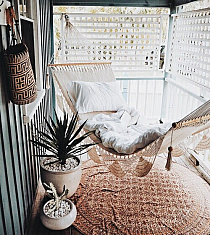
This screenshot has width=210, height=235. Identify the location of book. (129, 120).